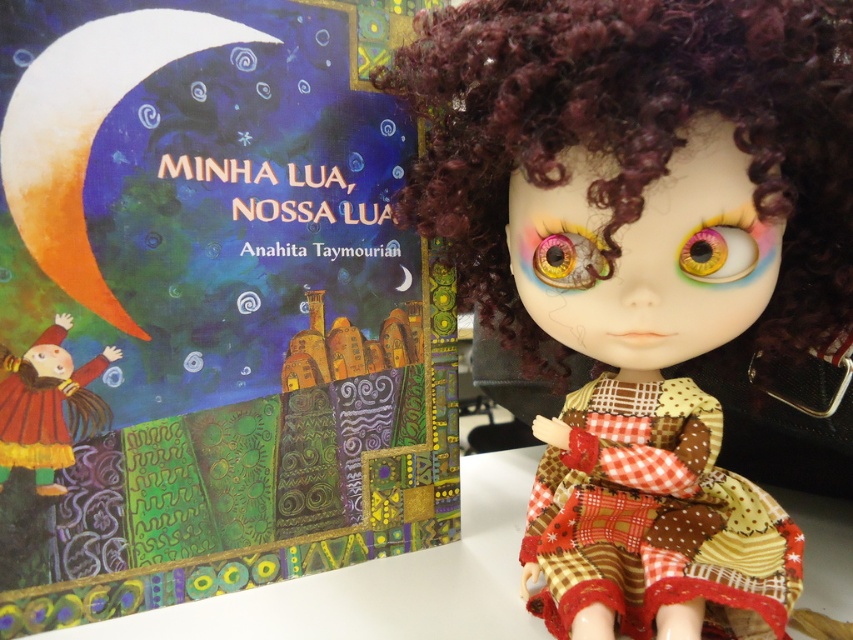
Question: Is matte yellow dress at lower left bigger than multicolored glass eye at upper center?

Choices:
 (A) no
 (B) yes

Answer: (B)

Question: Which point is farther to the camera?

Choices:
 (A) (817, 298)
 (B) (582, 248)
 (C) (724, 250)

Answer: (A)

Question: Among these points, which one is farthest from the camera?

Choices:
 (A) (602, 266)
 (B) (45, 376)

Answer: (B)

Question: Does matte paper book at upper left come behind patchwork fabric dress at right?

Choices:
 (A) no
 (B) yes

Answer: (B)

Question: Which point appears closest to the camera in this image?

Choices:
 (A) click(x=576, y=266)
 (B) click(x=726, y=237)

Answer: (B)

Question: Does patchwork fabric dress at right have a larger size compared to matte yellow dress at lower left?

Choices:
 (A) yes
 (B) no

Answer: (A)